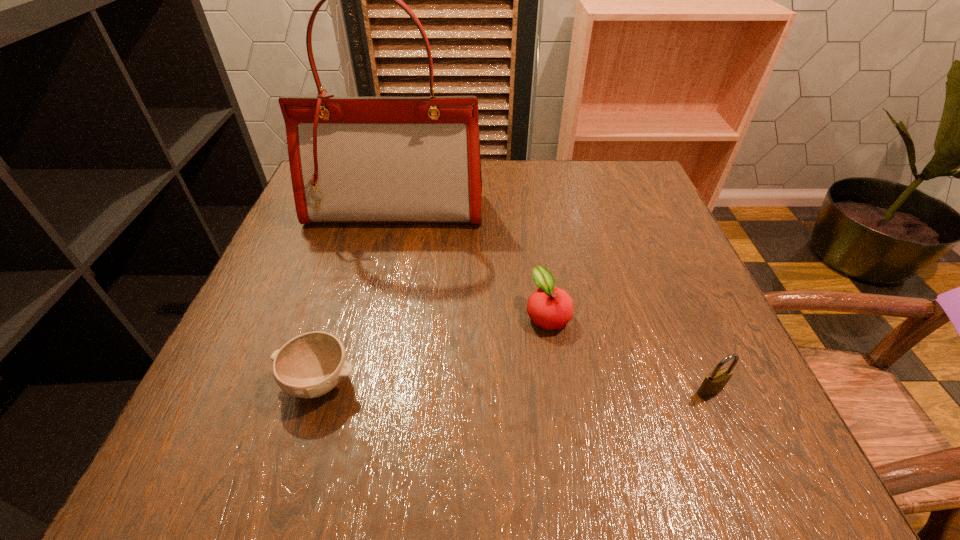
Where is `vacant region at the near right corner`? vacant region at the near right corner is located at coordinates (678, 434).

Where is `vacant space that is in between the third shortest object and the bowl`? The width and height of the screenshot is (960, 540). vacant space that is in between the third shortest object and the bowl is located at coordinates [x=515, y=386].

I want to click on empty space that is in between the bowl and the farthest object, so click(358, 296).

Where is `empty space that is in between the rightmost object and the third nearest object`? This screenshot has width=960, height=540. empty space that is in between the rightmost object and the third nearest object is located at coordinates (629, 352).

At what (x,y) coordinates should I click in order to perform the action: click on free space between the bowl and the handbag. Please return your answer as a coordinate pair (x, y). Looking at the image, I should click on (358, 296).

I want to click on vacant space that's between the bowl and the second tallest object, so click(x=515, y=386).

Identify the location of empty space between the padlock and the third object from left to right. (629, 352).

What are the coordinates of `vacant point located between the farthest object and the second farthest object` in the screenshot? It's located at (472, 262).

Locate an element on the screen. free space between the third shortest object and the third nearest object is located at coordinates coord(629,352).

Select which object is the second closest to the tallest object. Please provide its 2D coordinates. Your answer should be formatted as a tuple, i.e. [(x, y)], where the tuple contains the x and y coordinates of a point satisfying the conditions above.

[(310, 365)]